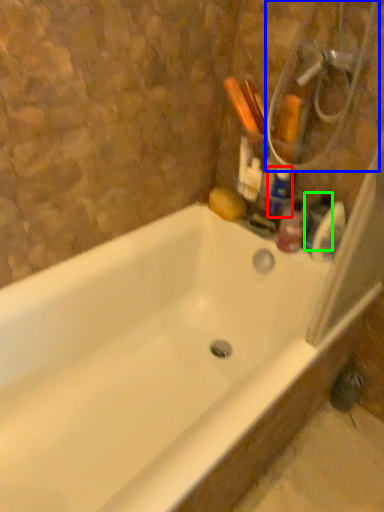
Question: Estimate the real-world distances between objects in this image. Which object is closer to cleaning product (highlighted by a red box), shower (highlighted by a blue box) or toiletry (highlighted by a green box)?

Choices:
 (A) shower
 (B) toiletry

Answer: (B)